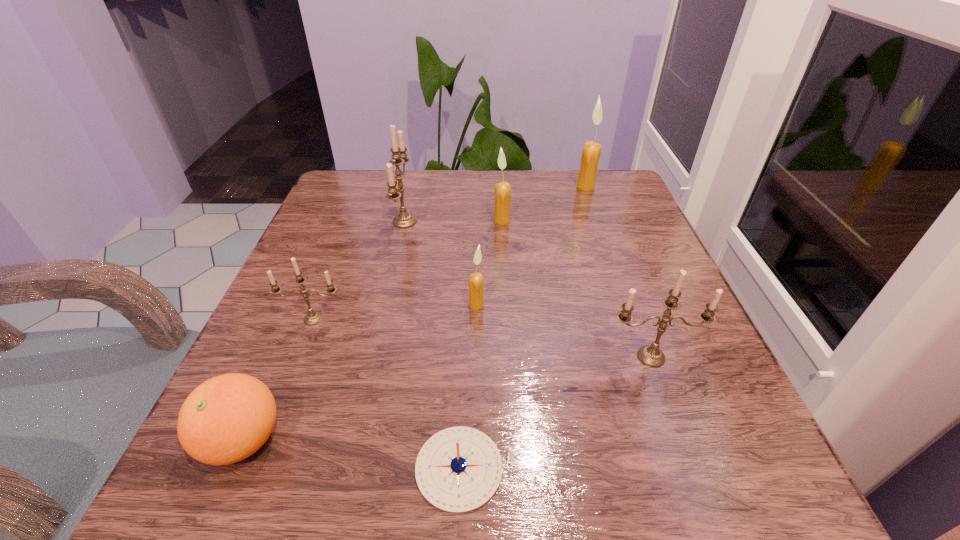
I want to click on vacant space located on the back of the leftmost cream candle, so click(x=477, y=211).

The height and width of the screenshot is (540, 960). I want to click on vacant position located on the back of the smallest metallic candle, so click(360, 200).

At what (x,y) coordinates should I click in order to perform the action: click on free space located on the right of the orange. Please return your answer as a coordinate pair (x, y). Looking at the image, I should click on [527, 440].

Locate an element on the screen. vacant region located 0.320m on the back of the blue compass is located at coordinates (466, 277).

The width and height of the screenshot is (960, 540). I want to click on orange located at the near edge, so click(x=227, y=418).

Identify the location of compass that is positioned at the near edge. (458, 469).

Locate an element on the screen. The image size is (960, 540). candle that is at the left edge is located at coordinates (312, 318).

Identify the location of orange that is at the left edge. The width and height of the screenshot is (960, 540). (227, 418).

Locate an element on the screen. Image resolution: width=960 pixels, height=540 pixels. object at the near left corner is located at coordinates (227, 418).

Locate an element on the screen. object that is at the far right corner is located at coordinates (591, 152).